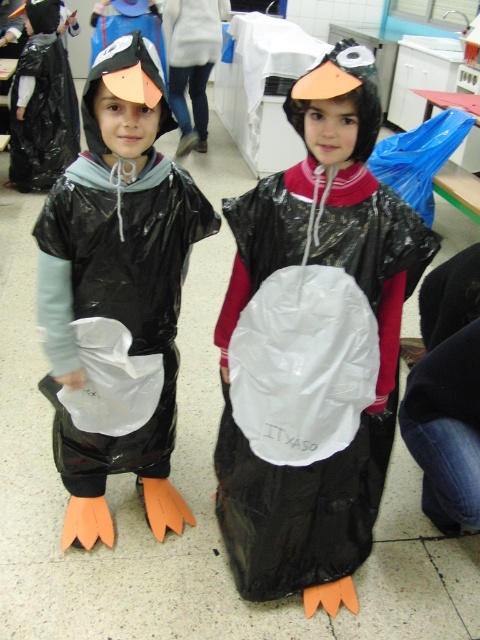
Question: In this image, where is matte black penguin costume at center located relative to matte black penguin at center?

Choices:
 (A) above
 (B) below

Answer: (A)

Question: Is matte black penguin costume at center smaller than matte black penguin at center?

Choices:
 (A) no
 (B) yes

Answer: (A)

Question: Is matte black penguin costume at center bigger than matte black penguin at center?

Choices:
 (A) yes
 (B) no

Answer: (A)

Question: Which point is farther from the camera taking this photo?

Choices:
 (A) (118, 376)
 (B) (303, 168)

Answer: (A)